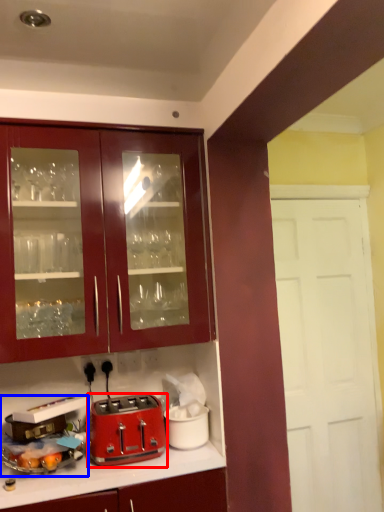
Question: Which point is further to the camera, toaster (highlighted by a red box) or appliance (highlighted by a blue box)?

Choices:
 (A) toaster
 (B) appliance

Answer: (A)